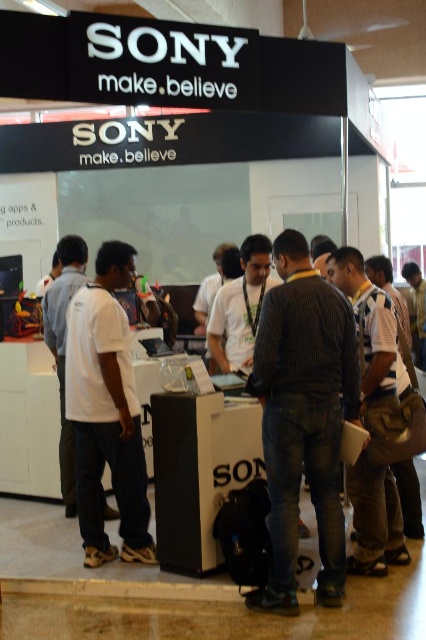
Can you confirm if dark striped shirt at center is positioned above white matte shirt at center?

Indeed, dark striped shirt at center is positioned over white matte shirt at center.

Which is below, dark striped shirt at center or white matte shirt at center?

white matte shirt at center is lower down.

Locate an element on the screen. dark striped shirt at center is located at coordinates (304, 417).